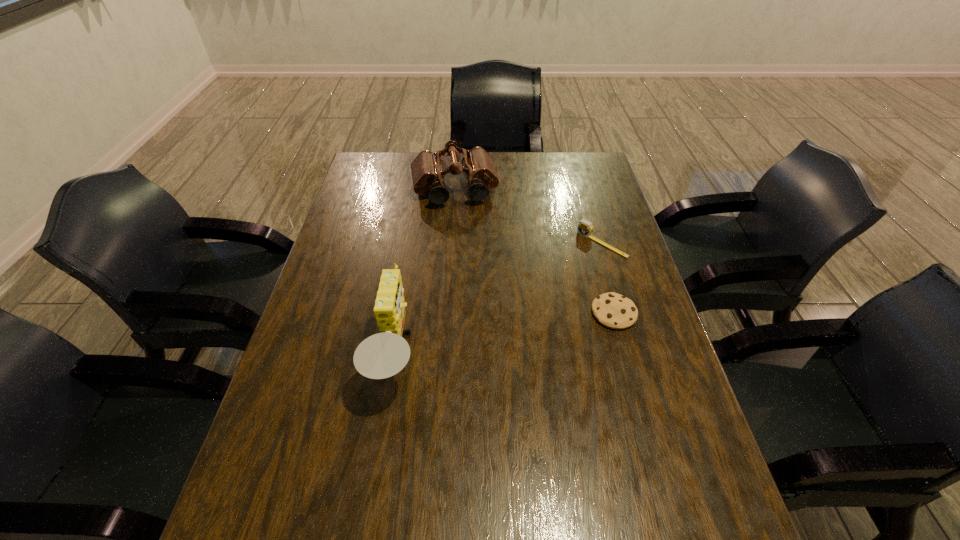
Locate an element on the screen. The height and width of the screenshot is (540, 960). the tallest object is located at coordinates (382, 355).

Identify the location of the shortest object. Image resolution: width=960 pixels, height=540 pixels. (615, 311).

The width and height of the screenshot is (960, 540). Find the location of `the farthest object`. the farthest object is located at coordinates (427, 170).

What are the coordinates of `the second tallest object` in the screenshot? It's located at (427, 170).

Find the location of `tape measure`. tape measure is located at coordinates (585, 227).

Image resolution: width=960 pixels, height=540 pixels. I want to click on the second shortest object, so click(585, 227).

Where is `vacant area situated 0.160m on the front-facing side of the sponge`? vacant area situated 0.160m on the front-facing side of the sponge is located at coordinates (487, 356).

Locate an element on the screen. This screenshot has width=960, height=540. vacant space located on the front of the shortest object is located at coordinates (661, 482).

Where is `free spot located 0.100m through the eyepieces of the farthest object`? This screenshot has width=960, height=540. free spot located 0.100m through the eyepieces of the farthest object is located at coordinates (463, 230).

Locate an element on the screen. This screenshot has width=960, height=540. free space located 0.110m through the eyepieces of the farthest object is located at coordinates (464, 232).